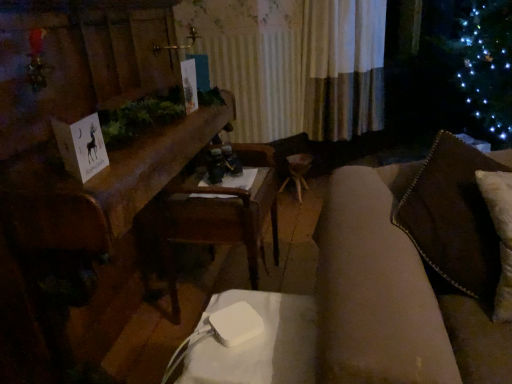
Question: Considering the relative positions of wooden table at center and white paper card at left in the image provided, is wooden table at center to the left or to the right of white paper card at left?

Choices:
 (A) left
 (B) right

Answer: (A)

Question: Is wooden table at center situated inside white paper card at left or outside?

Choices:
 (A) inside
 (B) outside

Answer: (B)

Question: Which object is the farthest from the wooden armchair at center?

Choices:
 (A) white paper card at left
 (B) white plastic table at lower center
 (C) wooden table at center

Answer: (B)

Question: Based on their relative distances, which object is farther from the wooden table at center?

Choices:
 (A) wooden armchair at center
 (B) white paper card at left
 (C) white plastic table at lower center

Answer: (C)